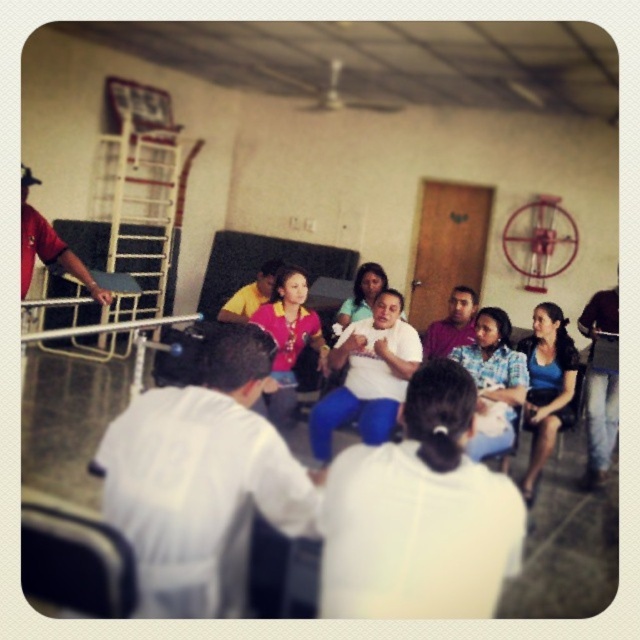
Question: Is white matte shirt at center smaller than blue matte shirt at right?

Choices:
 (A) yes
 (B) no

Answer: (A)

Question: Does white matte shirt at center appear on the right side of blue matte shirt at right?

Choices:
 (A) no
 (B) yes

Answer: (A)

Question: In this image, where is white matte shirt at center located relative to denim jeans at lower right?

Choices:
 (A) left
 (B) right

Answer: (A)

Question: Which of these objects is positioned farthest from the yellow shirt at center?

Choices:
 (A) matte pink shirt at center
 (B) blue cotton pants at center
 (C) white matte shirt at center
 (D) denim jeans at lower right

Answer: (B)

Question: Among these objects, which one is nearest to the camera?

Choices:
 (A) matte white shirt at center
 (B) denim jeans at lower right
 (C) blue fabric shirt at center
 (D) white matte shirt at center

Answer: (D)

Question: Among these objects, which one is nearest to the camera?

Choices:
 (A) purple shirt at center
 (B) blue cotton pants at center
 (C) yellow shirt at center

Answer: (B)